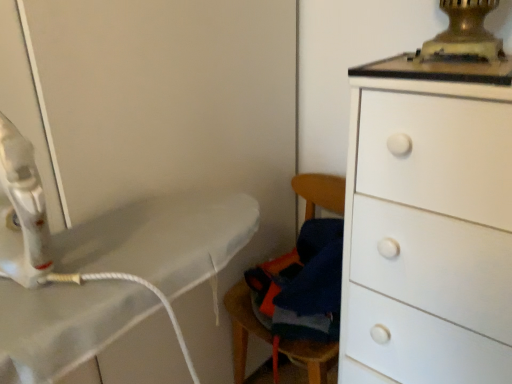
Measure the distance between point (369,164) and camera.

Point (369,164) is 32.40 inches from camera.

What do you see at coordinates (428, 224) in the screenshot?
I see `white matte chest of drawers at right` at bounding box center [428, 224].

Find the location of a particular element. white matte chest of drawers at right is located at coordinates (428, 224).

This screenshot has height=384, width=512. Describe the element at coordinates (242, 327) in the screenshot. I see `wooden swivel chair at lower center` at that location.

Measure the distance between wooden swivel chair at lower center and camera.

They are 1.07 meters apart.

At what (x,y) coordinates should I click in order to perform the action: click on wooden swivel chair at lower center. Please return your answer as a coordinate pair (x, y). The image size is (512, 384). Looking at the image, I should click on (242, 327).

Locate an element on the screen. The height and width of the screenshot is (384, 512). white matte chest of drawers at right is located at coordinates [428, 224].

Is white matte chest of drawers at right at the left side of wooden swivel chair at lower center?

No.

Does white matte chest of drawers at right come in front of wooden swivel chair at lower center?

That is True.

Which is further, (412,230) or (230,293)?

Point (230,293)

Based on the photo, from the image's perspective, is white matte chest of drawers at right located above or below wooden swivel chair at lower center?

white matte chest of drawers at right is situated lower than wooden swivel chair at lower center in the image.

From a real-world perspective, which is physically above, white matte chest of drawers at right or wooden swivel chair at lower center?

white matte chest of drawers at right, from a real-world perspective.

Considering the sizes of white matte chest of drawers at right and wooden swivel chair at lower center in the image, is white matte chest of drawers at right wider or thinner than wooden swivel chair at lower center?

white matte chest of drawers at right is wider than wooden swivel chair at lower center.

Is white matte chest of drawers at right shorter than wooden swivel chair at lower center?

No, white matte chest of drawers at right is not shorter than wooden swivel chair at lower center.

Based on the photo, is white matte chest of drawers at right smaller than wooden swivel chair at lower center?

No.

Is white matte chest of drawers at right not inside wooden swivel chair at lower center?

Yes, white matte chest of drawers at right is not within wooden swivel chair at lower center.

Is white matte chest of drawers at right far away from wooden swivel chair at lower center?

No, white matte chest of drawers at right is not far away from wooden swivel chair at lower center.

Could you tell me if white matte chest of drawers at right is turned towards wooden swivel chair at lower center?

No, white matte chest of drawers at right is not oriented towards wooden swivel chair at lower center.

Can you tell me how much white matte chest of drawers at right and wooden swivel chair at lower center differ in facing direction?

There is a 0.533-degree angle between the facing directions of white matte chest of drawers at right and wooden swivel chair at lower center.

Locate an element on the screen. The image size is (512, 384). chest of drawers above the wooden swivel chair at lower center (from a real-world perspective) is located at coordinates (428, 224).

Considering the positions of objects wooden swivel chair at lower center and white matte chest of drawers at right in the image provided, who is more to the left, wooden swivel chair at lower center or white matte chest of drawers at right?

wooden swivel chair at lower center is more to the left.

Which object is closer to the camera, wooden swivel chair at lower center or white matte chest of drawers at right?

white matte chest of drawers at right is closer to the camera.

Does point (331, 197) appear closer or farther from the camera than point (440, 241)?

Point (331, 197) appears to be farther away from the viewer than point (440, 241).

From the image's perspective, which one is positioned lower, wooden swivel chair at lower center or white matte chest of drawers at right?

white matte chest of drawers at right, from the image's perspective.

From a real-world perspective, between wooden swivel chair at lower center and white matte chest of drawers at right, who is vertically higher?

From a 3D spatial view, white matte chest of drawers at right is above.

Which object is thinner, wooden swivel chair at lower center or white matte chest of drawers at right?

wooden swivel chair at lower center is thinner.

Considering the relative sizes of wooden swivel chair at lower center and white matte chest of drawers at right in the image provided, is wooden swivel chair at lower center shorter than white matte chest of drawers at right?

Yes, wooden swivel chair at lower center is shorter than white matte chest of drawers at right.

Is wooden swivel chair at lower center smaller than white matte chest of drawers at right?

Indeed, wooden swivel chair at lower center has a smaller size compared to white matte chest of drawers at right.

Is wooden swivel chair at lower center inside or outside of white matte chest of drawers at right?

wooden swivel chair at lower center is outside white matte chest of drawers at right.

Is wooden swivel chair at lower center beside white matte chest of drawers at right?

No, wooden swivel chair at lower center is not touching white matte chest of drawers at right.

Is wooden swivel chair at lower center facing towards white matte chest of drawers at right?

No.

What's the angular difference between wooden swivel chair at lower center and white matte chest of drawers at right's facing directions?

The angle between the facing direction of wooden swivel chair at lower center and the facing direction of white matte chest of drawers at right is 0.533 degrees.

Identify the location of chest of drawers in front of the wooden swivel chair at lower center. (428, 224).

At what (x,y) coordinates should I click in order to perform the action: click on swivel chair above the white matte chest of drawers at right (from the image's perspective). Please return your answer as a coordinate pair (x, y). The width and height of the screenshot is (512, 384). Looking at the image, I should click on (242, 327).

Where is `chest of drawers above the wooden swivel chair at lower center (from a real-world perspective)`? The image size is (512, 384). chest of drawers above the wooden swivel chair at lower center (from a real-world perspective) is located at coordinates (428, 224).